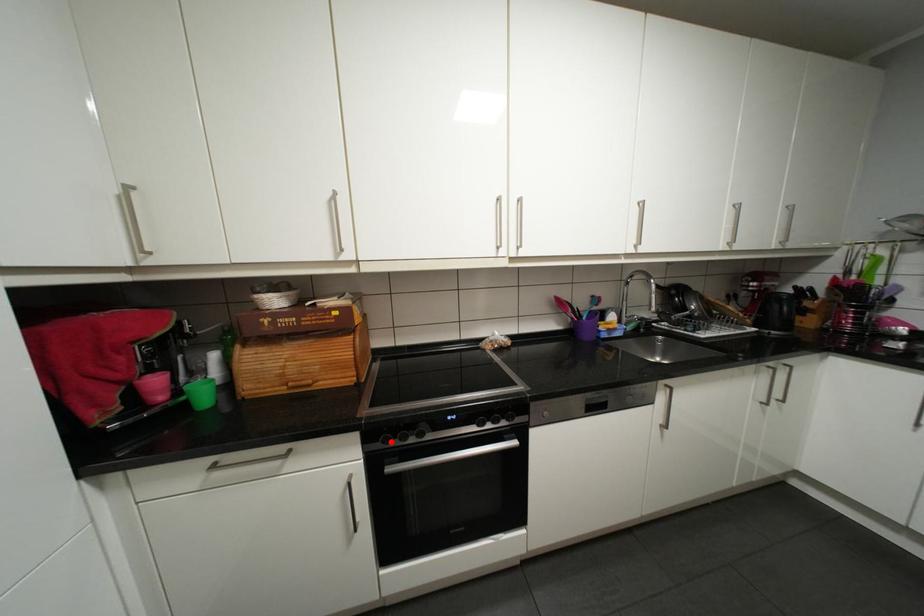
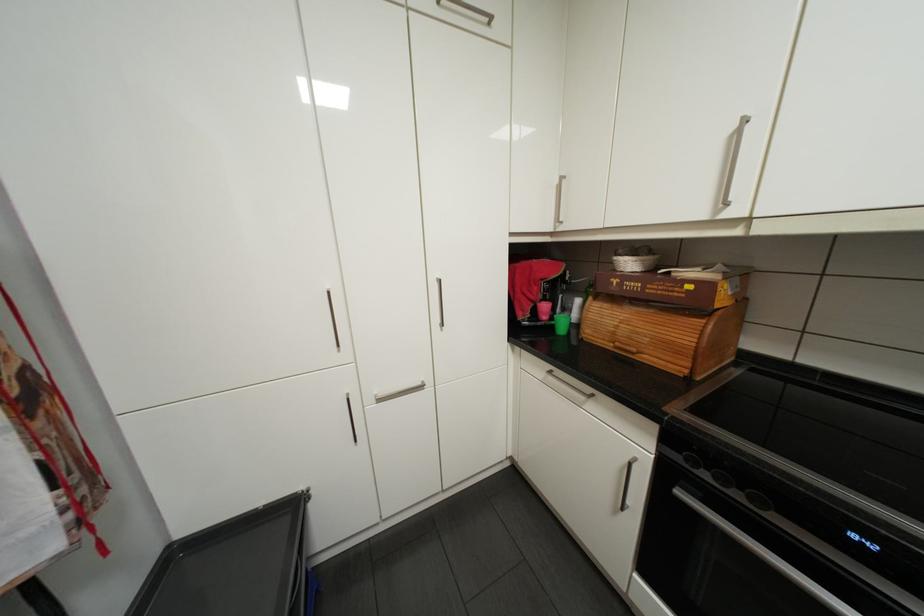
The point at the highlighted location is marked in the first image. Where is the corresponding point in the second image?

(695, 459)